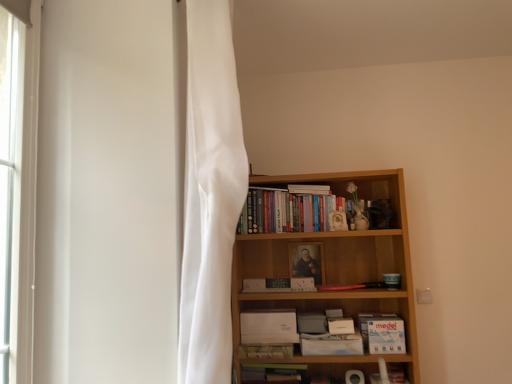
Where is `white matte paperback book at lower right, which is the second paperback book in right-to-left order`? white matte paperback book at lower right, which is the second paperback book in right-to-left order is located at coordinates (340, 325).

At what (x,y) coordinates should I click in order to perform the action: click on wooden book at center, acting as the 1th book starting from the bottom. Please return your answer as a coordinate pair (x, y). The height and width of the screenshot is (384, 512). Looking at the image, I should click on (272, 373).

Image resolution: width=512 pixels, height=384 pixels. What do you see at coordinates (279, 285) in the screenshot?
I see `matte white paperback book at center, placed as the 3th paperback book when sorted from left to right` at bounding box center [279, 285].

How much space does hardcover books at upper center, which is counted as the second book, starting from the top, occupy horizontally?

9.47 inches.

The image size is (512, 384). I want to click on green matte paperback book at lower center, which appears as the 6th paperback book when viewed from the right, so click(265, 351).

The width and height of the screenshot is (512, 384). What are the coordinates of `white matte paperback book at lower right, the 5th paperback book from the left` in the screenshot? It's located at (340, 325).

From a real-world perspective, is matte white paperback book at center, placed as the 3th paperback book when sorted from left to right, physically located above or below white matte paperback book at lower center, the third paperback book positioned from the right?

In terms of real-world spatial position, matte white paperback book at center, placed as the 3th paperback book when sorted from left to right, is above white matte paperback book at lower center, the third paperback book positioned from the right.

Visually, is matte white paperback book at center, positioned as the fourth paperback book in right-to-left order, positioned to the left or to the right of white matte paperback book at lower center, the 4th paperback book from the left?

From the image, it's evident that matte white paperback book at center, positioned as the fourth paperback book in right-to-left order, is to the left of white matte paperback book at lower center, the 4th paperback book from the left.

Which is in front, point (295, 280) or point (303, 345)?

The point (303, 345) is closer.

Consider the image. Is matte white paperback book at center, positioned as the fourth paperback book in right-to-left order, bigger than white matte paperback book at lower center, the 4th paperback book from the left?

No, matte white paperback book at center, positioned as the fourth paperback book in right-to-left order, is not bigger than white matte paperback book at lower center, the 4th paperback book from the left.

Can you tell me how much white matte paperback book at lower right, the 5th paperback book from the left, and wooden book at center, acting as the 1th book starting from the bottom, differ in facing direction?

white matte paperback book at lower right, the 5th paperback book from the left, and wooden book at center, acting as the 1th book starting from the bottom, are facing 2.56 degrees away from each other.

Can you confirm if white matte paperback book at lower right, the 5th paperback book from the left, is wider than wooden book at center, which is counted as the third book, starting from the top?

No, white matte paperback book at lower right, the 5th paperback book from the left, is not wider than wooden book at center, which is counted as the third book, starting from the top.

From the image's perspective, does white matte paperback book at lower right, which is the second paperback book in right-to-left order, appear higher than wooden book at center, acting as the 1th book starting from the bottom?

Yes, from the image's perspective, white matte paperback book at lower right, which is the second paperback book in right-to-left order, is on top of wooden book at center, acting as the 1th book starting from the bottom.

Is white matte paperback book at lower right, the 5th paperback book from the left, in contact with wooden book at center, acting as the 1th book starting from the bottom?

No, white matte paperback book at lower right, the 5th paperback book from the left, is not with wooden book at center, acting as the 1th book starting from the bottom.

Are hardcover books at upper center, which is counted as the second book, starting from the top, and white paper book at upper center, placed as the 1th book when sorted from top to bottom, beside each other?

hardcover books at upper center, which is counted as the second book, starting from the top, is not next to white paper book at upper center, placed as the 1th book when sorted from top to bottom, and they're not touching.

Considering the relative sizes of hardcover books at upper center, which appears as the 2th book when ordered from the bottom, and white paper book at upper center, the 3th book positioned from the bottom, in the image provided, is hardcover books at upper center, which appears as the 2th book when ordered from the bottom, smaller than white paper book at upper center, the 3th book positioned from the bottom,?

No.

Which is nearer, (322, 215) or (293, 185)?

The point (322, 215) is more forward.

Is hardcover books at upper center, which appears as the 2th book when ordered from the bottom, positioned with its back to white paper book at upper center, the 3th book positioned from the bottom?

Yes.

Which is behind, hardcover books at upper center, which is counted as the second book, starting from the top, or wooden bookcase at center?

hardcover books at upper center, which is counted as the second book, starting from the top.

From a real-world perspective, is hardcover books at upper center, which is counted as the second book, starting from the top, on top of wooden bookcase at center?

Yes, from a real-world perspective, hardcover books at upper center, which is counted as the second book, starting from the top, is over wooden bookcase at center

Can you confirm if hardcover books at upper center, which appears as the 2th book when ordered from the bottom, is taller than wooden bookcase at center?

No.

Does hardcover books at upper center, which is counted as the second book, starting from the top, have a larger size compared to wooden bookcase at center?

Actually, hardcover books at upper center, which is counted as the second book, starting from the top, might be smaller than wooden bookcase at center.

From the image's perspective, which is above, hardcover books at upper center, which appears as the 2th book when ordered from the bottom, or matte white paperback book at center, placed as the 3th paperback book when sorted from left to right?

hardcover books at upper center, which appears as the 2th book when ordered from the bottom, is shown above in the image.

How far apart are hardcover books at upper center, which is counted as the second book, starting from the top, and matte white paperback book at center, placed as the 3th paperback book when sorted from left to right?

15.15 inches.

Would you say hardcover books at upper center, which is counted as the second book, starting from the top, is a long distance from matte white paperback book at center, placed as the 3th paperback book when sorted from left to right?

Actually, hardcover books at upper center, which is counted as the second book, starting from the top, and matte white paperback book at center, placed as the 3th paperback book when sorted from left to right, are a little close together.

Does hardcover books at upper center, which is counted as the second book, starting from the top, have a lesser width compared to matte white paperback book at center, positioned as the fourth paperback book in right-to-left order?

Incorrect, the width of hardcover books at upper center, which is counted as the second book, starting from the top, is not less than that of matte white paperback book at center, positioned as the fourth paperback book in right-to-left order.

Which paperback book is the 1st one when counting from the front of the hardcover books at upper center, which is counted as the second book, starting from the top? Please provide its 2D coordinates.

[(331, 344)]

From the image's perspective, is white matte paperback book at lower center, the third paperback book positioned from the right, located above or below hardcover books at upper center, which is counted as the second book, starting from the top?

white matte paperback book at lower center, the third paperback book positioned from the right, is situated lower than hardcover books at upper center, which is counted as the second book, starting from the top, in the image.

Is white matte paperback book at lower center, the 4th paperback book from the left, shorter than hardcover books at upper center, which is counted as the second book, starting from the top?

Yes.

Is hardcover books at upper center, which is counted as the second book, starting from the top, located within white matte paperback book at lower center, the 4th paperback book from the left?

That's incorrect, hardcover books at upper center, which is counted as the second book, starting from the top, is not inside white matte paperback book at lower center, the 4th paperback book from the left.

How far apart are hardcover books at upper center, which appears as the 2th book when ordered from the bottom, and white matte paperback book at lower right, the 5th paperback book from the left?

hardcover books at upper center, which appears as the 2th book when ordered from the bottom, and white matte paperback book at lower right, the 5th paperback book from the left, are 25.35 inches apart.

Is hardcover books at upper center, which appears as the 2th book when ordered from the bottom, looking in the opposite direction of white matte paperback book at lower right, the 5th paperback book from the left?

No, white matte paperback book at lower right, the 5th paperback book from the left, is not at the back of hardcover books at upper center, which appears as the 2th book when ordered from the bottom.

From the image's perspective, is hardcover books at upper center, which is counted as the second book, starting from the top, under white matte paperback book at lower right, which is the second paperback book in right-to-left order?

No, from the image's perspective, hardcover books at upper center, which is counted as the second book, starting from the top, is not beneath white matte paperback book at lower right, which is the second paperback book in right-to-left order.

Is point (288, 204) farther from viewer compared to point (340, 328)?

Yes, it is behind point (340, 328).

At what (x,y) coordinates should I click in order to perform the action: click on the 4th paperback book below the matte white paperback book at center, placed as the 3th paperback book when sorted from left to right (from the image's perspective). Please return your answer as a coordinate pair (x, y). This screenshot has width=512, height=384. Looking at the image, I should click on (331, 344).

The width and height of the screenshot is (512, 384). Find the location of `the 2nd book in front of the white matte paperback book at lower right, the 5th paperback book from the left`. the 2nd book in front of the white matte paperback book at lower right, the 5th paperback book from the left is located at coordinates pyautogui.click(x=272, y=373).

Looking at this image, which object lies nearer to the anchor point matte white paperback book at center, positioned as the fourth paperback book in right-to-left order, white sheer curtain at left or white matte paperback book at lower right, positioned as the 1th paperback book in right-to-left order?

Among the two, white matte paperback book at lower right, positioned as the 1th paperback book in right-to-left order, is located nearer to matte white paperback book at center, positioned as the fourth paperback book in right-to-left order.

Estimate the real-world distances between objects in this image. Which object is further from white sheer curtain at left, matte white paperback book at center, positioned as the fourth paperback book in right-to-left order, or wooden bookcase at center?

Among the two, wooden bookcase at center is located further to white sheer curtain at left.

Consider the image. Which object lies nearer to the anchor point white sheer curtain at left, white matte paperback book at lower right, the 5th paperback book from the left, or matte white paperback book at center, positioned as the fourth paperback book in right-to-left order?

matte white paperback book at center, positioned as the fourth paperback book in right-to-left order, lies closer to white sheer curtain at left than the other object.

Based on their spatial positions, is wooden book at center, acting as the 1th book starting from the bottom, or white paper book at upper center, the 3th book positioned from the bottom, further from hardcover books at upper center, which is counted as the second book, starting from the top?

Among the two, wooden book at center, acting as the 1th book starting from the bottom, is located further to hardcover books at upper center, which is counted as the second book, starting from the top.

From the image, which object appears to be nearer to white matte paperback book at lower center, placed as the 5th paperback book when sorted from right to left, white sheer curtain at left or green matte paperback book at lower center, which appears as the 6th paperback book when viewed from the right?

green matte paperback book at lower center, which appears as the 6th paperback book when viewed from the right, is positioned closer to the anchor white matte paperback book at lower center, placed as the 5th paperback book when sorted from right to left.

Based on their spatial positions, is matte white paperback book at center, placed as the 3th paperback book when sorted from left to right, or white sheer curtain at left further from white paper book at upper center, placed as the 1th book when sorted from top to bottom?

white sheer curtain at left lies further to white paper book at upper center, placed as the 1th book when sorted from top to bottom, than the other object.

Estimate the real-world distances between objects in this image. Which object is closer to white matte paperback book at lower center, the third paperback book positioned from the right, green matte paperback book at lower center, which is the 1th paperback book from left to right, or white matte paperback book at lower right, the 5th paperback book from the left?

white matte paperback book at lower right, the 5th paperback book from the left, is positioned closer to the anchor white matte paperback book at lower center, the third paperback book positioned from the right.

Looking at the image, which one is located further to wooden book at center, which is counted as the third book, starting from the top, wooden bookcase at center or matte white paperback book at center, placed as the 3th paperback book when sorted from left to right?

Based on the image, wooden bookcase at center appears to be further to wooden book at center, which is counted as the third book, starting from the top.

You are a GUI agent. You are given a task and a screenshot of the screen. Output one action in this format:
    pyautogui.click(x=<x>, y=<y>)
    Task: Click on the curtain positioned between white sheer curtain at left and green matte paperback book at lower center, which appears as the 6th paperback book when viewed from the right, from near to far
    The image size is (512, 384).
    Given the screenshot: What is the action you would take?
    pyautogui.click(x=210, y=194)

Image resolution: width=512 pixels, height=384 pixels. Find the location of `curtain located between white sheer curtain at left and white matte paperback book at lower right, which is the second paperback book in right-to-left order, in the depth direction`. curtain located between white sheer curtain at left and white matte paperback book at lower right, which is the second paperback book in right-to-left order, in the depth direction is located at coordinates (210, 194).

Locate an element on the screen. The image size is (512, 384). bookcase between white sheer curtain at left and white matte paperback book at lower center, the third paperback book positioned from the right is located at coordinates (334, 262).

Find the location of a particular element. The height and width of the screenshot is (384, 512). paperback book between wooden book at center, which is counted as the third book, starting from the top, and white matte paperback book at lower right, which is the second paperback book in right-to-left order, from left to right is located at coordinates [331, 344].